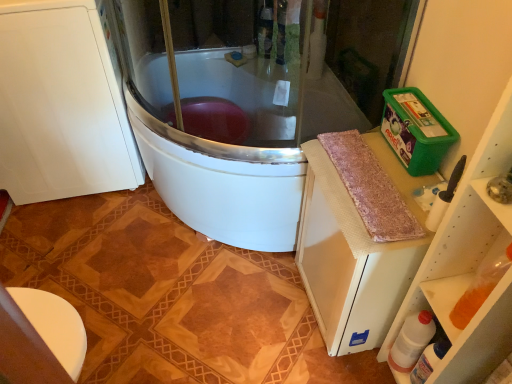
Question: Is point (42, 66) positioned closer to the camera than point (433, 168)?

Choices:
 (A) closer
 (B) farther

Answer: (B)

Question: Would you say white matte cabinet at left is inside or outside green plastic container at upper right, the 1th appliance positioned from the top?

Choices:
 (A) inside
 (B) outside

Answer: (B)

Question: Which is farther from the white matte cabinet at left?

Choices:
 (A) pink shaggy rug at right
 (B) green plastic container at upper right, positioned as the first appliance in back-to-front order
 (C) white plastic bottle at lower right, which is the 2th bottle in right-to-left order
 (D) black plastic brush at right, marked as the second appliance in a back-to-front arrangement
 (E) green plastic container at upper right

Answer: (C)

Question: Estimate the real-world distances between objects in this image. Which object is closer to the pink shaggy rug at right?

Choices:
 (A) green plastic container at upper right, arranged as the 2th appliance when ordered from the bottom
 (B) white plastic bottle at lower right, the first bottle positioned from the right
 (C) white glossy bathtub at center
 (D) white matte cabinet at left
 (E) black plastic brush at right, the 1th appliance in the front-to-back sequence

Answer: (A)